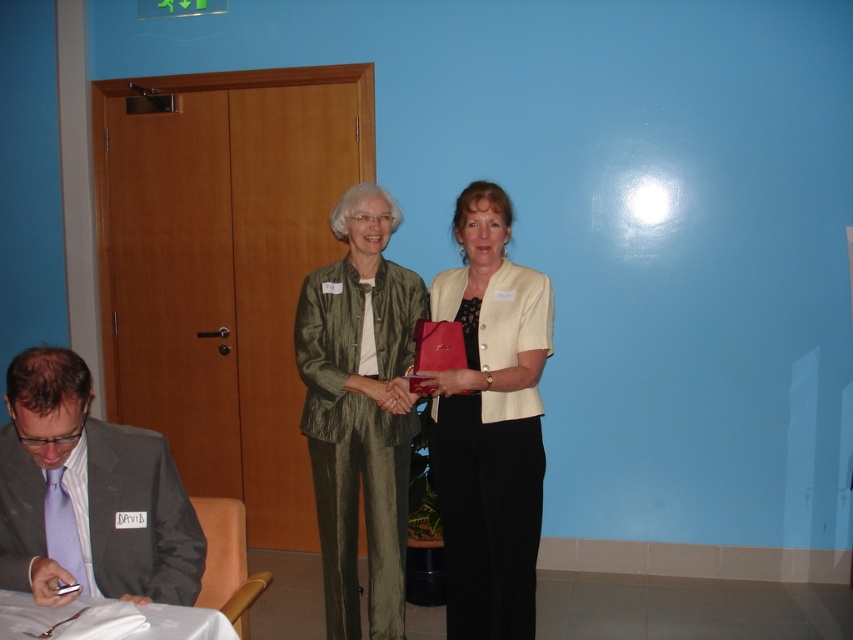
You are a photographer taking a picture of the two women. You notice a point at coordinates (x=358, y=410). Where is this point located?

The point at (x=358, y=410) is located on the green textured suit at center.

You are an event organizer who needs to arrange seating for two guests wearing the green textured suit at center and the gray suit at lower left. Based on their positions in the image, which guest should be seated to the right of the other?

The green textured suit at center is positioned on the right side of gray suit at lower left, so the guest in the green textured suit at center should be seated to the right of the guest in the gray suit at lower left.

Based on the photo, you are a photographer standing near the camera. You need to take a photo of the matte cream blazer at center. Can you reach it without moving the camera? The camera has a 10 feet focal length lens.

The matte cream blazer at center and camera are 7.93 feet apart from each other. Since the camera has a 10 feet focal length lens, it can focus on objects up to 10 feet away. Therefore, the photographer can take the photo without moving the camera.